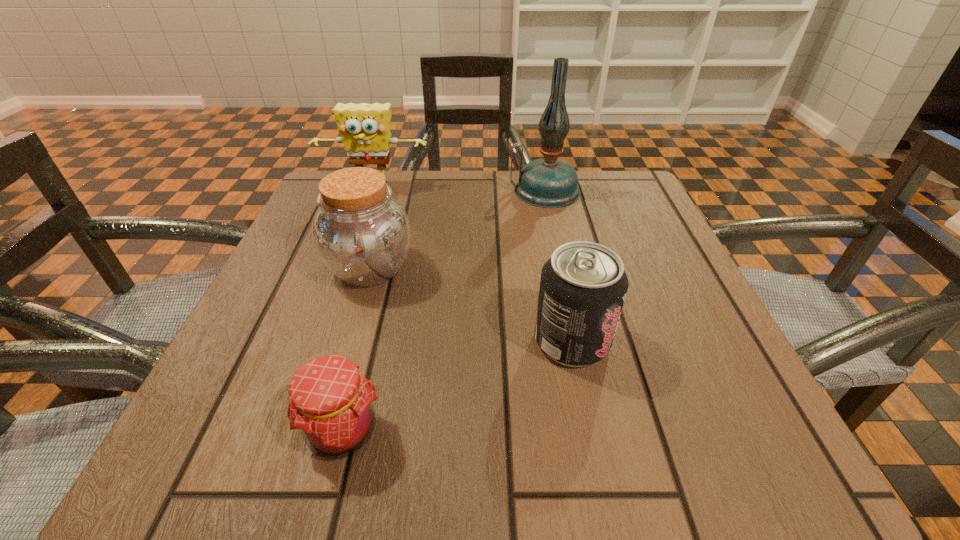
Where is `blank region between the oil lamp and the shortest object`? The width and height of the screenshot is (960, 540). blank region between the oil lamp and the shortest object is located at coordinates (444, 310).

Locate an element on the screen. empty space between the jar and the second nearest object is located at coordinates (470, 305).

Where is `vacant space that is in between the fourth farthest object and the sponge`? The height and width of the screenshot is (540, 960). vacant space that is in between the fourth farthest object and the sponge is located at coordinates (473, 265).

Identify the location of free space between the third farthest object and the tallest object. This screenshot has width=960, height=540. (457, 230).

Where is `free point between the sponge and the tallest object`? The image size is (960, 540). free point between the sponge and the tallest object is located at coordinates (459, 190).

Find the location of a particular element. Image resolution: width=960 pixels, height=540 pixels. unoccupied position between the shortest object and the jar is located at coordinates (356, 349).

Where is `object that stands as the third closest to the jar`? object that stands as the third closest to the jar is located at coordinates (583, 286).

Locate which object ranks second in proximity to the sponge. Please provide its 2D coordinates. Your answer should be formatted as a tuple, i.e. [(x, y)], where the tuple contains the x and y coordinates of a point satisfying the conditions above.

[(548, 182)]

This screenshot has width=960, height=540. Identify the location of free space that satisfies the following two spatial constraints: 1. on the face of the second nearest object; 2. on the right side of the sponge. (319, 341).

Image resolution: width=960 pixels, height=540 pixels. In order to click on vacant area in the image that satisfies the following two spatial constraints: 1. on the front side of the third farthest object; 2. on the left side of the nearest object in this screenshot , I will do `click(323, 430)`.